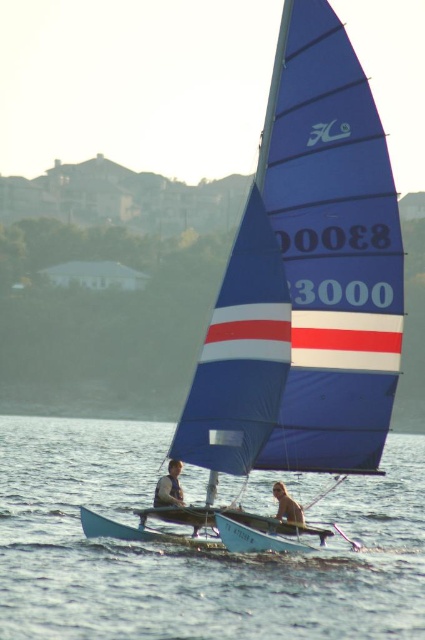
Based on the photo, who is taller, blue fabric sailboat at center or light brown leather jacket at lower left?

Standing taller between the two is blue fabric sailboat at center.

Where is `blue fabric sailboat at center`? Image resolution: width=425 pixels, height=640 pixels. blue fabric sailboat at center is located at coordinates (306, 278).

Identify the location of blue fabric sailboat at center. The height and width of the screenshot is (640, 425). (306, 278).

This screenshot has height=640, width=425. Find the location of `blue fabric sailboat at center`. blue fabric sailboat at center is located at coordinates (306, 278).

Who is more distant from viewer, [79,595] or [164,490]?

The point [164,490] is more distant.

Who is positioned more to the left, blue water at center or light brown leather jacket at lower left?

From the viewer's perspective, light brown leather jacket at lower left appears more on the left side.

This screenshot has height=640, width=425. I want to click on blue water at center, so click(x=187, y=550).